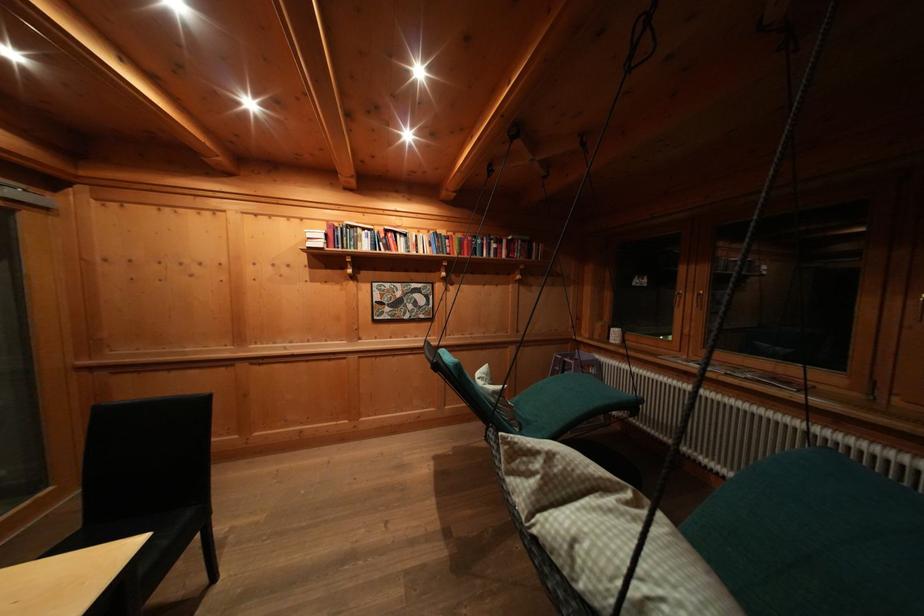
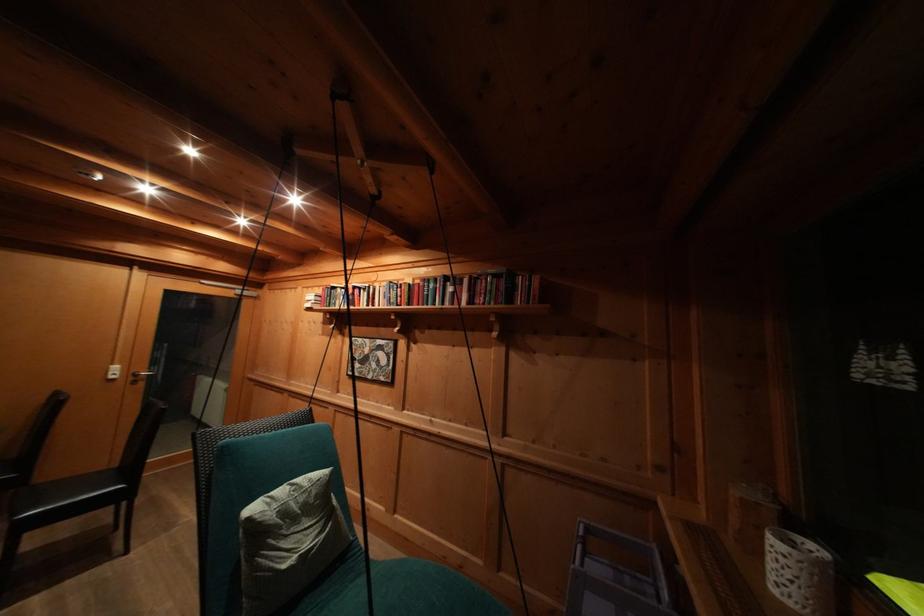
Where in the second image is the point corresponding to the point at 261,220 from the first image?

(313, 293)